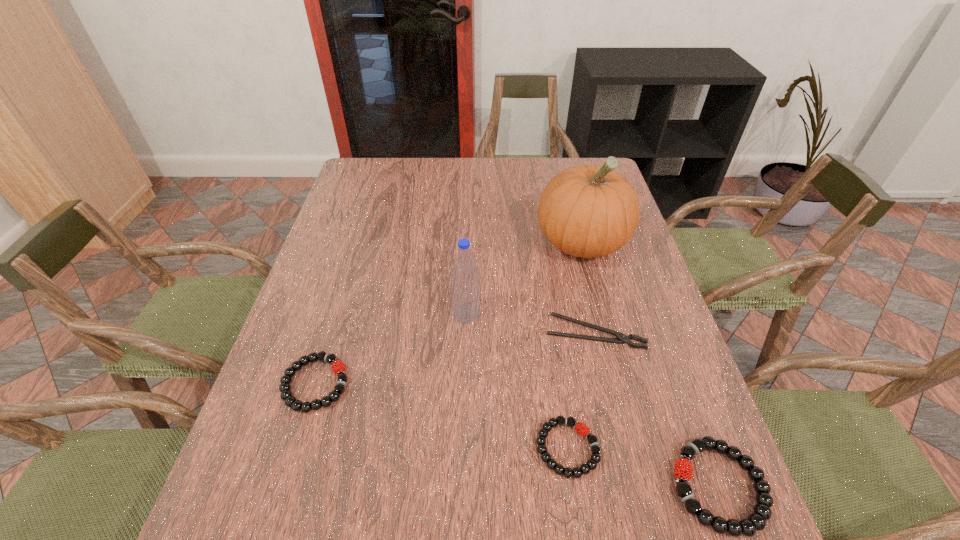
If the aim is uniform spacing by inserting an additional bracelet among them, please point to a vacant space for this new bracelet. Please provide its 2D coordinates. Your answer should be formatted as a tuple, i.e. [(x, y)], where the tuple contains the x and y coordinates of a point satisfying the conditions above.

[(435, 414)]